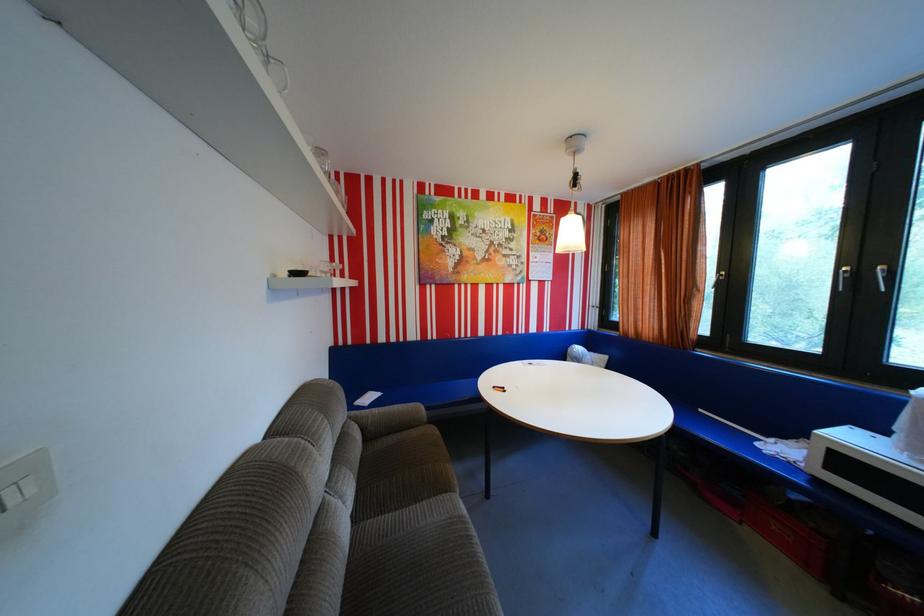
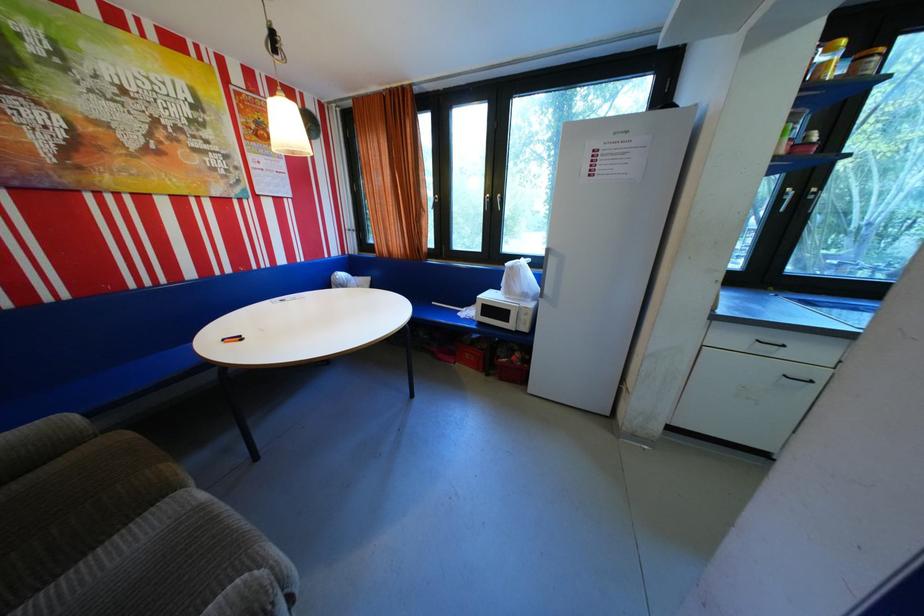
Based on the continuous images, in which direction is the camera rotating?

The camera's rotation is toward right-down.